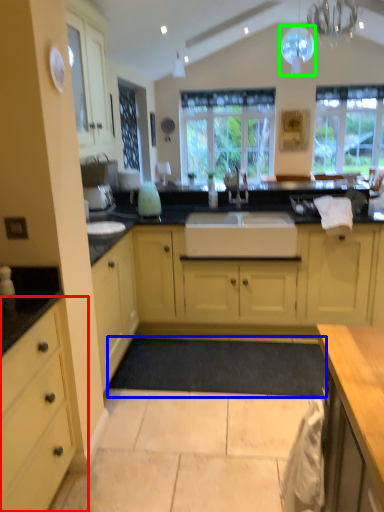
Question: Considering the real-world distances, which object is farthest from cabinetry (highlighted by a red box)? plain (highlighted by a blue box) or light fixture (highlighted by a green box)?

Choices:
 (A) plain
 (B) light fixture

Answer: (B)